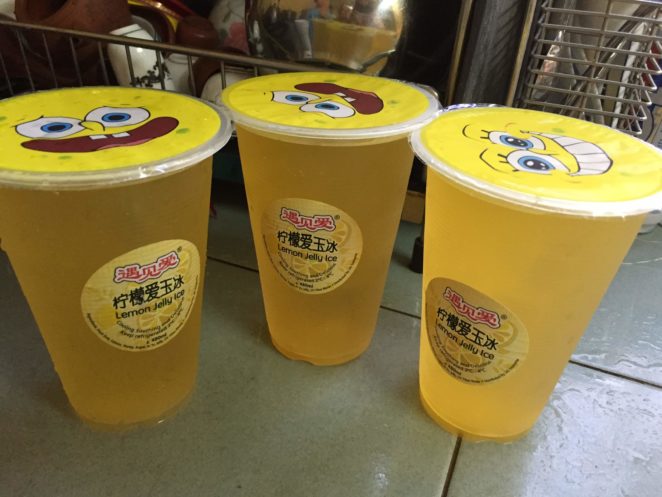
Locate an element on the screen. The image size is (662, 497). dishes is located at coordinates (250, 20), (183, 20), (130, 43), (75, 11).